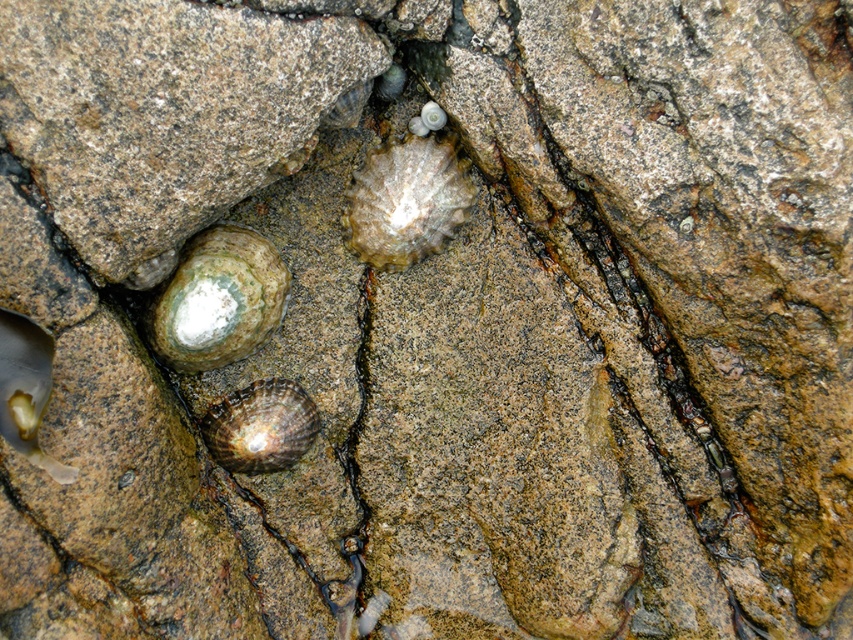
Which is more to the left, translucent brown shell at center or shiny brown shell at center?

Positioned to the left is shiny brown shell at center.

Who is higher up, translucent brown shell at center or shiny brown shell at center?

translucent brown shell at center is higher up.

Which is behind, point (422, 204) or point (229, 410)?

Positioned behind is point (229, 410).

This screenshot has height=640, width=853. Find the location of `translucent brown shell at center`. translucent brown shell at center is located at coordinates (405, 200).

Who is shorter, greenish-brown stone at lower left or translucent brown shell at center?

Standing shorter between the two is translucent brown shell at center.

Can you confirm if greenish-brown stone at lower left is positioned to the right of translucent brown shell at center?

In fact, greenish-brown stone at lower left is to the left of translucent brown shell at center.

You are a GUI agent. You are given a task and a screenshot of the screen. Output one action in this format:
    pyautogui.click(x=<x>, y=<y>)
    Task: Click on the greenish-brown stone at lower left
    
    Given the screenshot: What is the action you would take?
    pyautogui.click(x=219, y=300)

I want to click on greenish-brown stone at lower left, so click(x=219, y=300).

Can you confirm if greenish-brown stone at lower left is thinner than shiny brown shell at center?

No, greenish-brown stone at lower left is not thinner than shiny brown shell at center.

From the picture: Which is more to the left, greenish-brown stone at lower left or shiny brown shell at center?

greenish-brown stone at lower left is more to the left.

From the picture: Who is more forward, (258, 332) or (270, 440)?

Point (258, 332) is in front.

Where is `greenish-brown stone at lower left`? The width and height of the screenshot is (853, 640). greenish-brown stone at lower left is located at coordinates (219, 300).